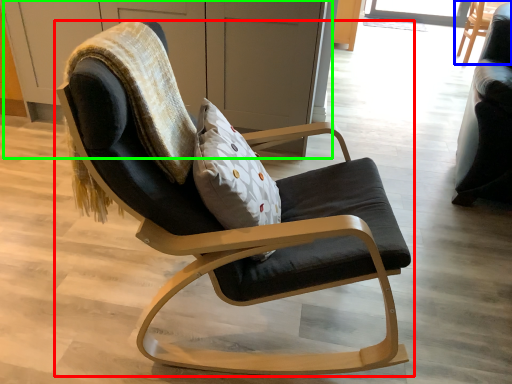
Question: Which object is positioned closest to chair (highlighted by a red box)? Select from chair (highlighted by a blue box) and dresser (highlighted by a green box).

Choices:
 (A) chair
 (B) dresser

Answer: (B)